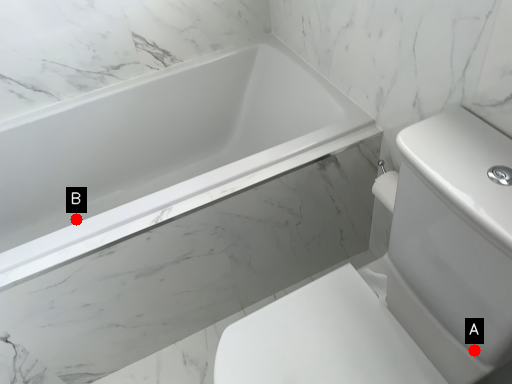
Question: Two points are circled on the image, labeled by A and B beside each circle. Which point is farther from the camera taking this photo?

Choices:
 (A) A is further
 (B) B is further

Answer: (B)